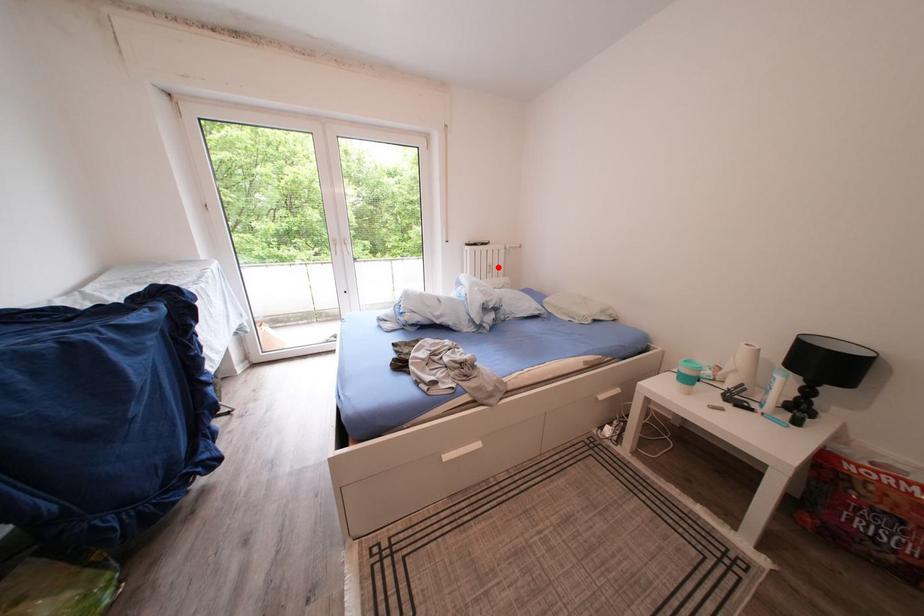
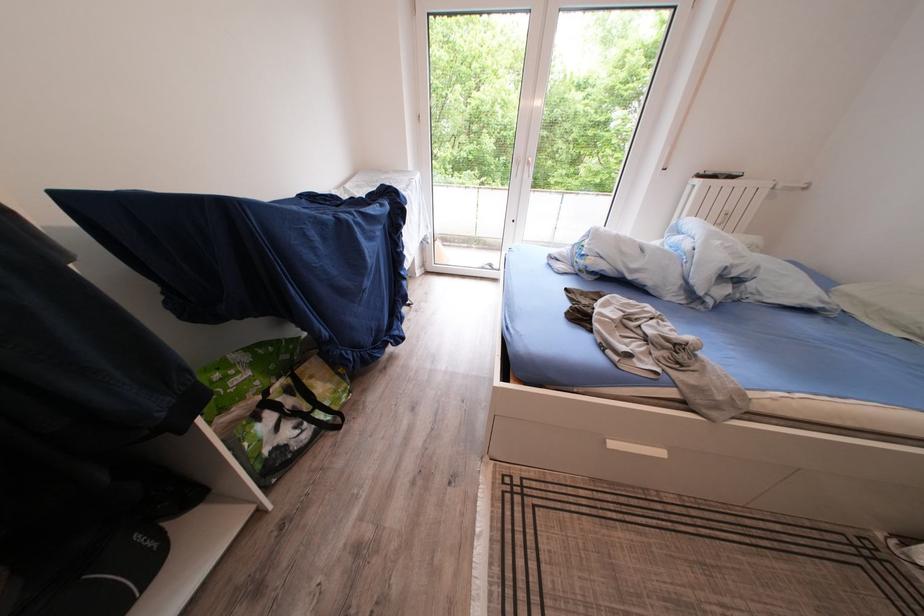
Locate, in the second image, the point that corresponds to the highlighted location in the first image.

(737, 213)